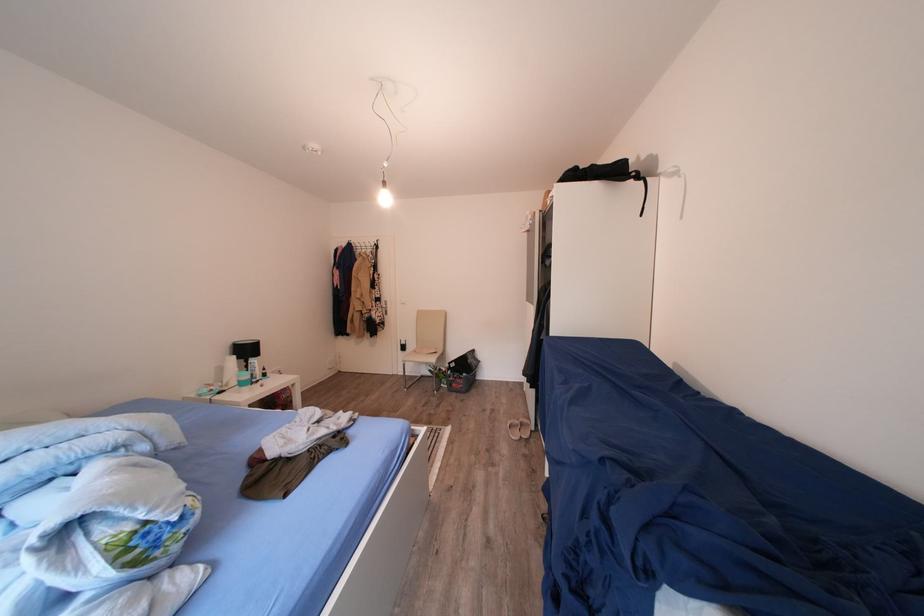
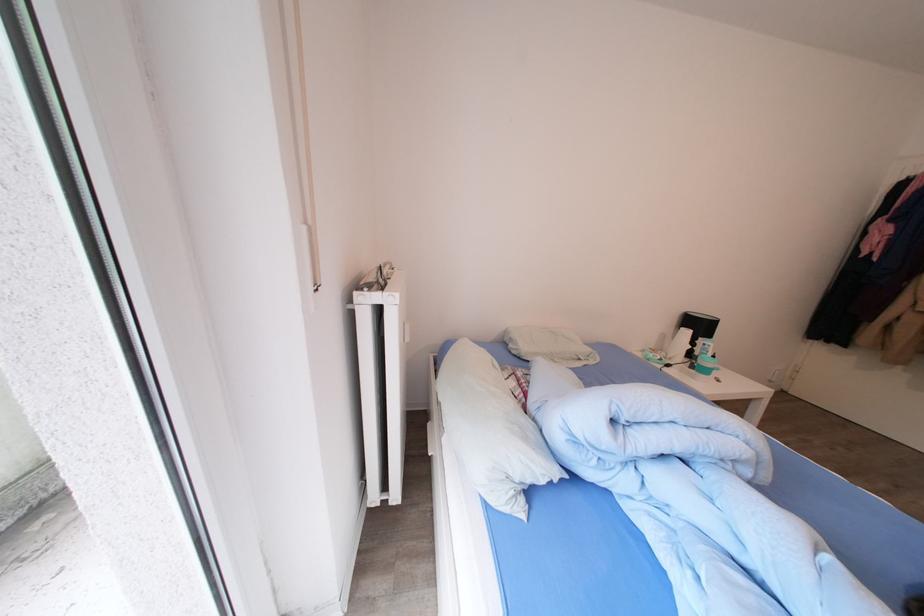
Locate, in the second image, the point that corresponds to (262,376) in the first image.

(712, 360)